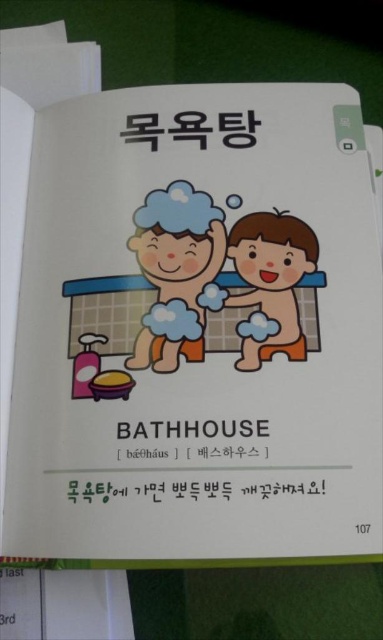
Question: From the image, what is the correct spatial relationship of matte blue sponge at center in relation to smooth orange sponge at center?

Choices:
 (A) left
 (B) right

Answer: (A)

Question: Does matte blue sponge at center appear over smooth orange sponge at center?

Choices:
 (A) no
 (B) yes

Answer: (B)

Question: Is matte blue sponge at center to the left of smooth orange sponge at center from the viewer's perspective?

Choices:
 (A) no
 (B) yes

Answer: (B)

Question: Which point is closer to the camera?

Choices:
 (A) (178, 200)
 (B) (283, 232)

Answer: (B)